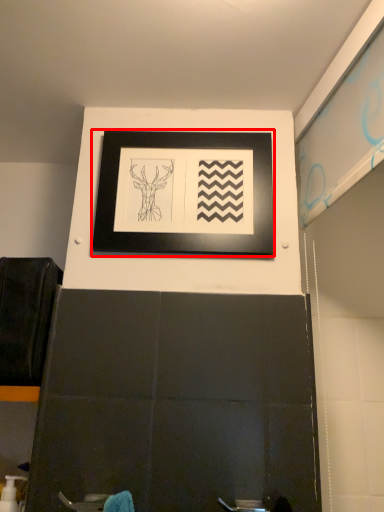
Question: From the image's perspective, what is the correct spatial relationship of picture frame (annotated by the red box) in relation to toiletry?

Choices:
 (A) above
 (B) below

Answer: (A)